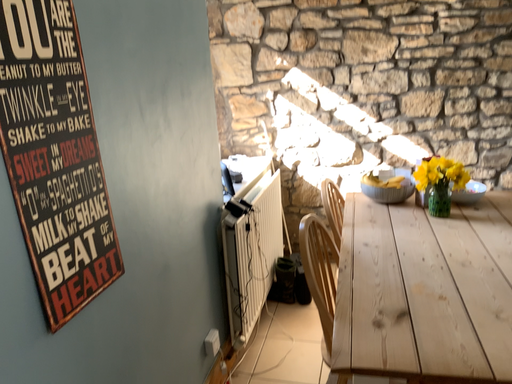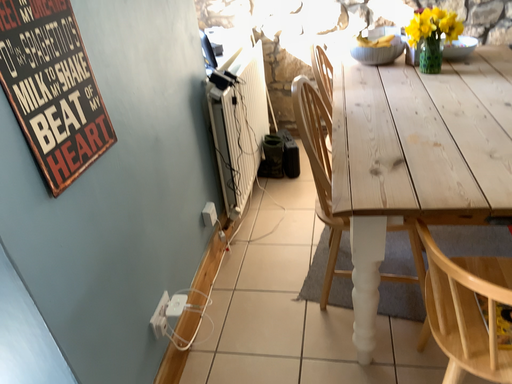
Question: How did the camera likely rotate when shooting the video?

Choices:
 (A) rotated downward
 (B) rotated upward

Answer: (A)